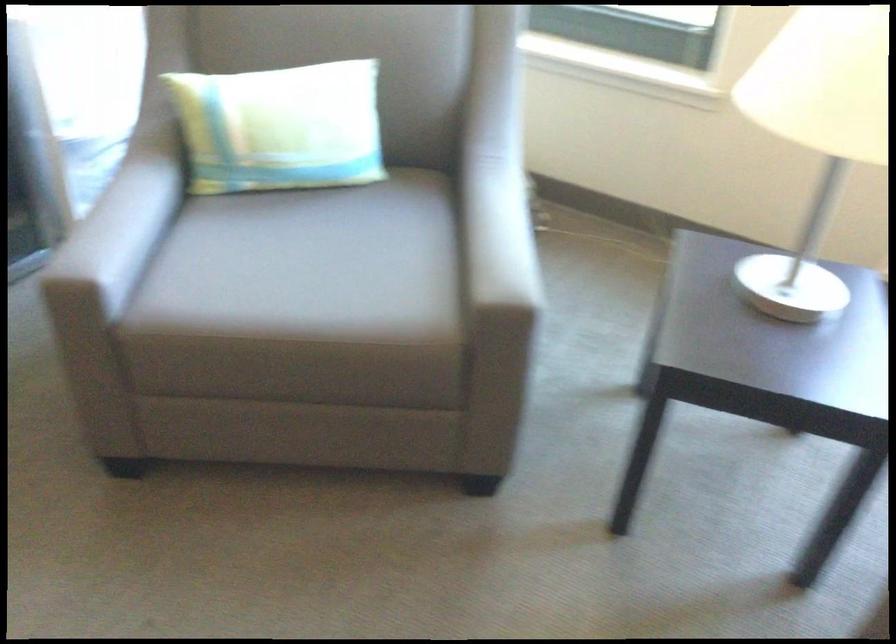
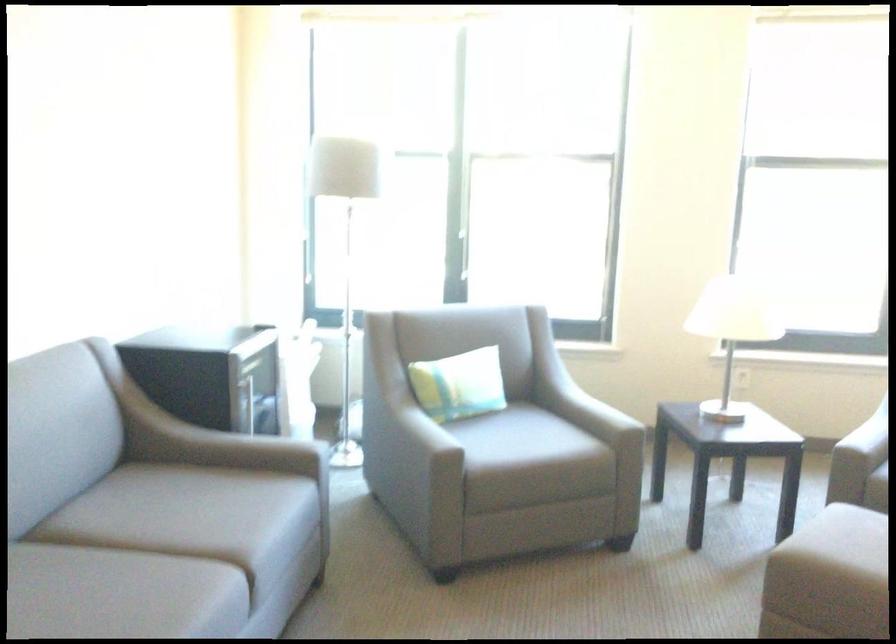
Locate, in the second image, the point that corresponds to (x=187, y=162) in the first image.

(356, 420)